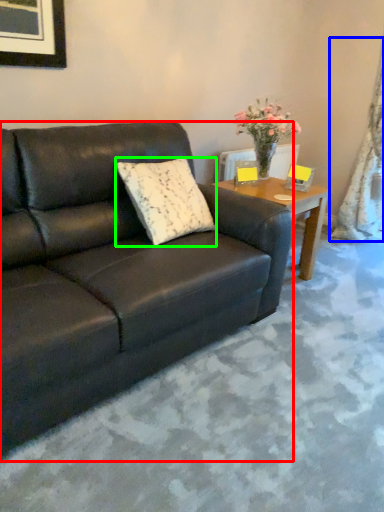
Question: Which is farther away from studio couch (highlighted by a red box)? curtain (highlighted by a blue box) or pillow (highlighted by a green box)?

Choices:
 (A) curtain
 (B) pillow

Answer: (A)